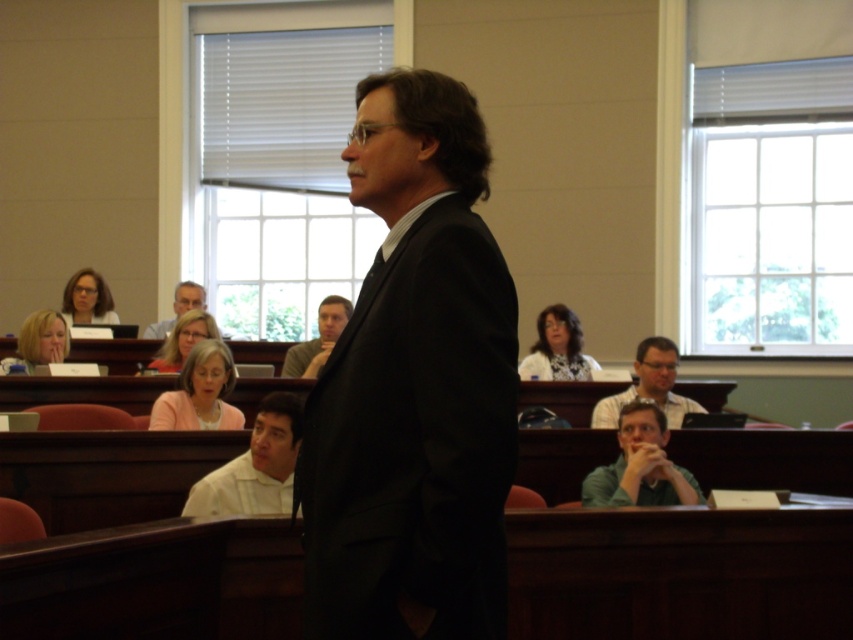
Who is positioned more to the left, white shirt at lower center or green matte shirt at lower center?

white shirt at lower center is more to the left.

Measure the distance between white shirt at lower center and camera.

The distance of white shirt at lower center from camera is 4.65 meters.

What do you see at coordinates (254, 467) in the screenshot?
I see `white shirt at lower center` at bounding box center [254, 467].

Image resolution: width=853 pixels, height=640 pixels. Find the location of `white shirt at lower center`. white shirt at lower center is located at coordinates (254, 467).

Does point (608, 397) come in front of point (338, 300)?

Yes, point (608, 397) is closer to viewer.

Who is lower down, light brown wood chair at lower right or gray fabric shirt at center?

light brown wood chair at lower right

Identify the location of light brown wood chair at lower right. The width and height of the screenshot is (853, 640). (648, 385).

Between point (314, 596) and point (294, 365), which one is positioned in front?

Point (314, 596) is in front.

Does black suit at center appear on the left side of gray fabric shirt at center?

In fact, black suit at center is to the right of gray fabric shirt at center.

The width and height of the screenshot is (853, 640). Describe the element at coordinates (415, 387) in the screenshot. I see `black suit at center` at that location.

The image size is (853, 640). I want to click on black suit at center, so click(415, 387).